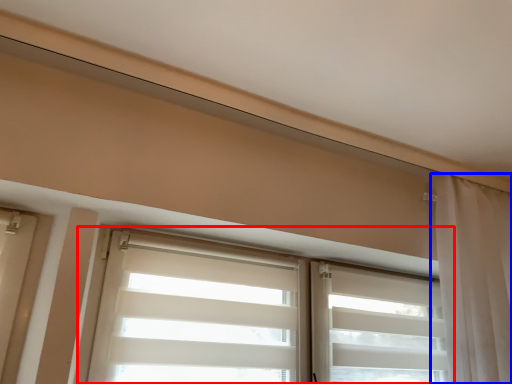
Question: Which point is further to the camera, window (highlighted by a red box) or curtain (highlighted by a blue box)?

Choices:
 (A) window
 (B) curtain

Answer: (B)